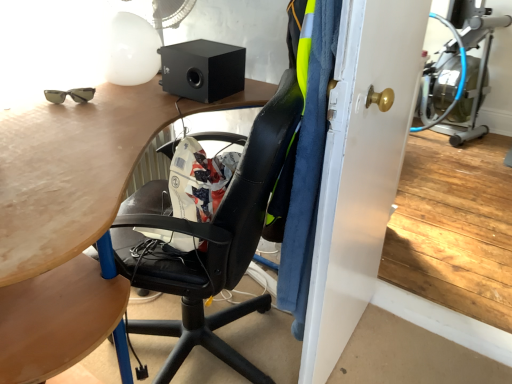
This screenshot has width=512, height=384. What are the coordinates of `free space that is to the left of matte gold door handle at center` in the screenshot? It's located at (258, 337).